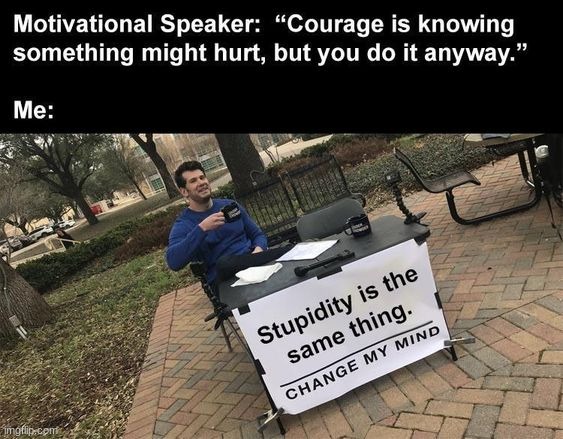
The height and width of the screenshot is (439, 563). Find the location of `table`. table is located at coordinates click(x=277, y=273), click(x=494, y=139).